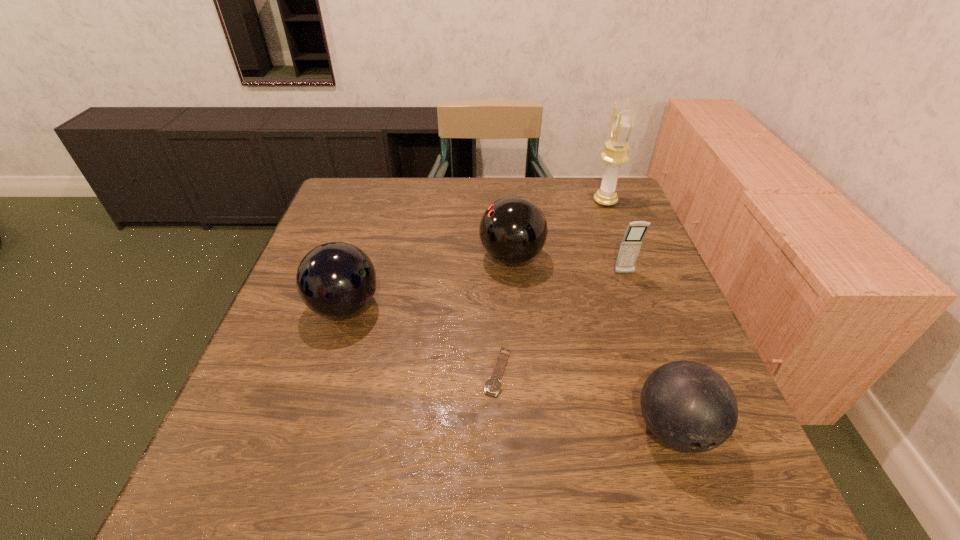
Identify the location of free space located 0.250m on the front-facing side of the award. The width and height of the screenshot is (960, 540). (509, 201).

At what (x,y) coordinates should I click in order to perform the action: click on blank space located on the surface of the second bowling ball from left to right near the finger holes. Please return your answer as a coordinate pair (x, y). Image resolution: width=960 pixels, height=540 pixels. Looking at the image, I should click on (452, 257).

Find the location of a particular element. Image resolution: width=960 pixels, height=540 pixels. blank space located on the surface of the second bowling ball from left to right near the finger holes is located at coordinates (385, 257).

Locate an element on the screen. This screenshot has width=960, height=540. free region located on the surface of the second bowling ball from left to right near the finger holes is located at coordinates (389, 257).

Find the location of a particular element. This screenshot has width=960, height=540. blank space located on the side of the second farthest bowling ball with the finger holes is located at coordinates (425, 307).

This screenshot has height=540, width=960. I want to click on vacant space located on the front-facing side of the cellular telephone, so click(x=658, y=364).

Identify the location of free space located on the grip area of the nearest bowling ball. (701, 502).

Where is `vacant region located on the left of the shortest object`? vacant region located on the left of the shortest object is located at coordinates (278, 372).

Locate an element on the screen. This screenshot has height=540, width=960. object present at the far edge is located at coordinates (622, 121).

This screenshot has height=540, width=960. In order to click on object that is at the near edge in this screenshot , I will do (688, 406).